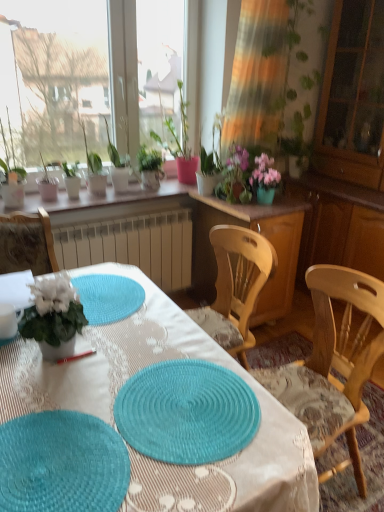
I want to click on vacant area on top of teal woven mat at lower left, which is the 1th mat in left-to-right order (from a real-world perspective), so click(x=54, y=461).